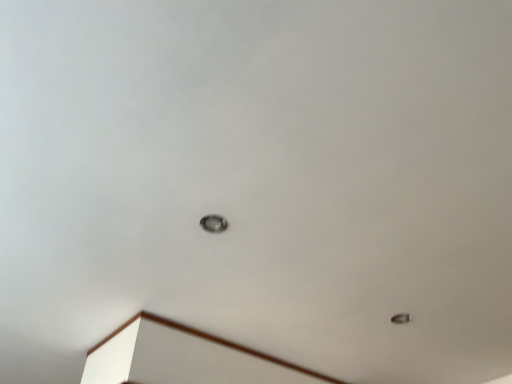
The height and width of the screenshot is (384, 512). What do you see at coordinates (400, 318) in the screenshot?
I see `metallic ring at lower right, positioned as the first lamp in right-to-left order` at bounding box center [400, 318].

This screenshot has height=384, width=512. What are the coordinates of `metallic ring at lower right, which ranks as the first lamp in back-to-front order` in the screenshot? It's located at (400, 318).

Image resolution: width=512 pixels, height=384 pixels. What do you see at coordinates (213, 223) in the screenshot?
I see `satin silver lamp at center, which is the 1th lamp in top-to-bottom order` at bounding box center [213, 223].

In order to click on satin silver lamp at center, which is the second lamp in back-to-front order in this screenshot , I will do `click(213, 223)`.

Where is `metallic ring at lower right, which ranks as the first lamp in back-to-front order`? The width and height of the screenshot is (512, 384). metallic ring at lower right, which ranks as the first lamp in back-to-front order is located at coordinates (400, 318).

Is metallic ring at lower right, the first lamp from the bottom, to the left of satin silver lamp at center, positioned as the 1th lamp in left-to-right order, from the viewer's perspective?

No, metallic ring at lower right, the first lamp from the bottom, is not to the left of satin silver lamp at center, positioned as the 1th lamp in left-to-right order.

Is metallic ring at lower right, the first lamp from the bottom, in front of or behind satin silver lamp at center, positioned as the 1th lamp in left-to-right order, in the image?

Clearly, metallic ring at lower right, the first lamp from the bottom, is behind satin silver lamp at center, positioned as the 1th lamp in left-to-right order.

Which point is more forward, (x=402, y=318) or (x=214, y=228)?

The point (x=214, y=228) is more forward.

Based on the photo, from the image's perspective, is metallic ring at lower right, positioned as the second lamp in left-to-right order, above or below satin silver lamp at center, which appears as the second lamp when viewed from the right?

Clearly, from the image's perspective, metallic ring at lower right, positioned as the second lamp in left-to-right order, is below satin silver lamp at center, which appears as the second lamp when viewed from the right.

From a real-world perspective, is metallic ring at lower right, positioned as the first lamp in right-to-left order, positioned over satin silver lamp at center, which is the second lamp in back-to-front order, based on gravity?

Actually, metallic ring at lower right, positioned as the first lamp in right-to-left order, is physically below satin silver lamp at center, which is the second lamp in back-to-front order, in the real world.

Looking at their sizes, would you say metallic ring at lower right, the first lamp from the bottom, is wider or thinner than satin silver lamp at center, which appears as the second lamp when viewed from the right?

Clearly, metallic ring at lower right, the first lamp from the bottom, has less width compared to satin silver lamp at center, which appears as the second lamp when viewed from the right.

Considering the sizes of objects metallic ring at lower right, which ranks as the 2th lamp in top-to-bottom order, and satin silver lamp at center, which is the 1th lamp in top-to-bottom order, in the image provided, who is taller, metallic ring at lower right, which ranks as the 2th lamp in top-to-bottom order, or satin silver lamp at center, which is the 1th lamp in top-to-bottom order,?

With more height is satin silver lamp at center, which is the 1th lamp in top-to-bottom order.

Does metallic ring at lower right, which ranks as the first lamp in back-to-front order, have a larger size compared to satin silver lamp at center, which is the second lamp in back-to-front order?

No, metallic ring at lower right, which ranks as the first lamp in back-to-front order, is not bigger than satin silver lamp at center, which is the second lamp in back-to-front order.

Is metallic ring at lower right, which ranks as the 2th lamp in top-to-bottom order, surrounding satin silver lamp at center, positioned as the 1th lamp in left-to-right order?

No.

Consider the image. Is metallic ring at lower right, which ranks as the 2th lamp in top-to-bottom order, directly adjacent to satin silver lamp at center, positioned as the 1th lamp in left-to-right order?

No.

Is metallic ring at lower right, the first lamp from the bottom, facing away from satin silver lamp at center, placed as the second lamp when sorted from bottom to top?

No.

I want to click on lamp below the satin silver lamp at center, placed as the 1th lamp when sorted from front to back (from a real-world perspective), so click(x=400, y=318).

Considering the positions of objects satin silver lamp at center, which is the second lamp in back-to-front order, and metallic ring at lower right, which ranks as the first lamp in back-to-front order, in the image provided, who is more to the right, satin silver lamp at center, which is the second lamp in back-to-front order, or metallic ring at lower right, which ranks as the first lamp in back-to-front order,?

metallic ring at lower right, which ranks as the first lamp in back-to-front order.

In the scene shown: Considering the positions of objects satin silver lamp at center, which appears as the second lamp when viewed from the right, and metallic ring at lower right, positioned as the second lamp in left-to-right order, in the image provided, who is in front, satin silver lamp at center, which appears as the second lamp when viewed from the right, or metallic ring at lower right, positioned as the second lamp in left-to-right order,?

Positioned in front is satin silver lamp at center, which appears as the second lamp when viewed from the right.

Is point (209, 220) behind point (394, 319)?

No, it is in front of (394, 319).

From the image's perspective, between satin silver lamp at center, placed as the 1th lamp when sorted from front to back, and metallic ring at lower right, which ranks as the first lamp in back-to-front order, who is located below?

metallic ring at lower right, which ranks as the first lamp in back-to-front order, is shown below in the image.

Consider the image. From a real-world perspective, which object stands above the other?

satin silver lamp at center, placed as the 1th lamp when sorted from front to back, from a real-world perspective.

Looking at this image, does satin silver lamp at center, which appears as the second lamp when viewed from the right, have a lesser width compared to metallic ring at lower right, positioned as the first lamp in right-to-left order?

Incorrect, the width of satin silver lamp at center, which appears as the second lamp when viewed from the right, is not less than that of metallic ring at lower right, positioned as the first lamp in right-to-left order.

Is satin silver lamp at center, placed as the 1th lamp when sorted from front to back, shorter than metallic ring at lower right, which ranks as the first lamp in back-to-front order?

No.

Is satin silver lamp at center, placed as the 1th lamp when sorted from front to back, bigger than metallic ring at lower right, which ranks as the 2th lamp in top-to-bottom order?

Indeed, satin silver lamp at center, placed as the 1th lamp when sorted from front to back, has a larger size compared to metallic ring at lower right, which ranks as the 2th lamp in top-to-bottom order.

Does satin silver lamp at center, which is the 1th lamp in top-to-bottom order, contain metallic ring at lower right, positioned as the first lamp in right-to-left order?

No, metallic ring at lower right, positioned as the first lamp in right-to-left order, is not a part of satin silver lamp at center, which is the 1th lamp in top-to-bottom order.

Is satin silver lamp at center, placed as the 1th lamp when sorted from front to back, beside metallic ring at lower right, the first lamp from the bottom?

No, satin silver lamp at center, placed as the 1th lamp when sorted from front to back, is not touching metallic ring at lower right, the first lamp from the bottom.

Does satin silver lamp at center, placed as the 1th lamp when sorted from front to back, turn towards metallic ring at lower right, the first lamp from the bottom?

Yes.

How many degrees apart are the facing directions of satin silver lamp at center, positioned as the 1th lamp in left-to-right order, and metallic ring at lower right, which ranks as the first lamp in back-to-front order?

satin silver lamp at center, positioned as the 1th lamp in left-to-right order, and metallic ring at lower right, which ranks as the first lamp in back-to-front order, are facing 179 degrees away from each other.

Consider the image. How much distance is there between satin silver lamp at center, placed as the second lamp when sorted from bottom to top, and metallic ring at lower right, which ranks as the 2th lamp in top-to-bottom order?

satin silver lamp at center, placed as the second lamp when sorted from bottom to top, and metallic ring at lower right, which ranks as the 2th lamp in top-to-bottom order, are 85.00 centimeters apart from each other.

The image size is (512, 384). What are the coordinates of `lamp in front of the metallic ring at lower right, the second lamp from the front` in the screenshot? It's located at (213, 223).

The image size is (512, 384). I want to click on lamp below the satin silver lamp at center, which is the 1th lamp in top-to-bottom order (from the image's perspective), so click(x=400, y=318).

At what (x,y) coordinates should I click in order to perform the action: click on lamp behind the satin silver lamp at center, placed as the 1th lamp when sorted from front to back. Please return your answer as a coordinate pair (x, y). Looking at the image, I should click on (400, 318).